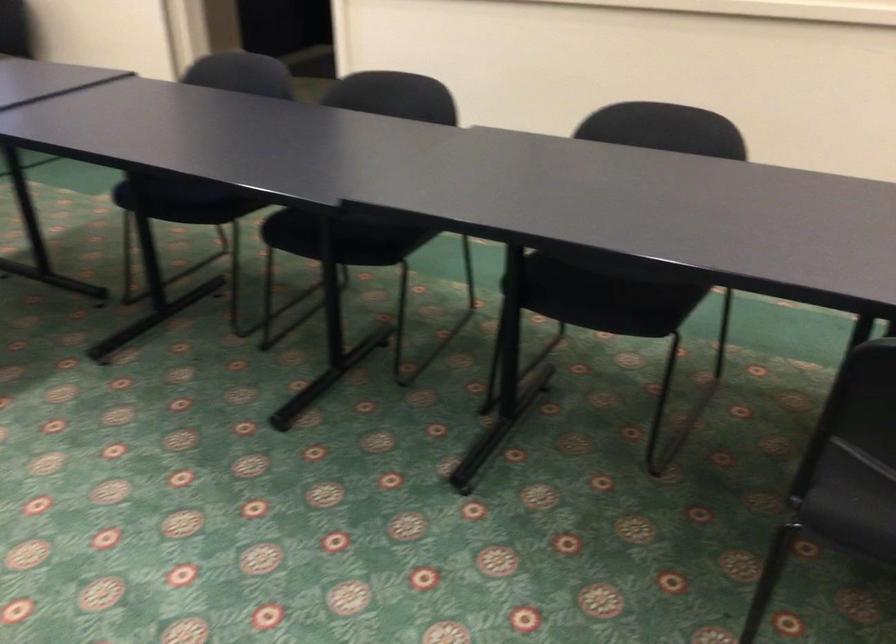
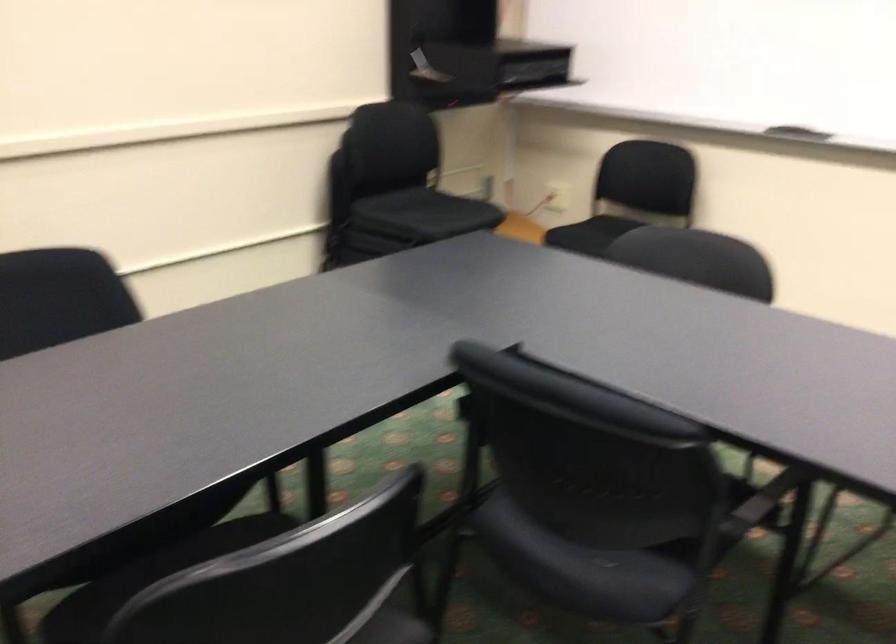
Question: The camera is either moving clockwise (left) or counter-clockwise (right) around the object. The first image is from the beginning of the video and the second image is from the end. Is the camera moving left or right when shooting the video?

Choices:
 (A) Left
 (B) Right

Answer: (A)